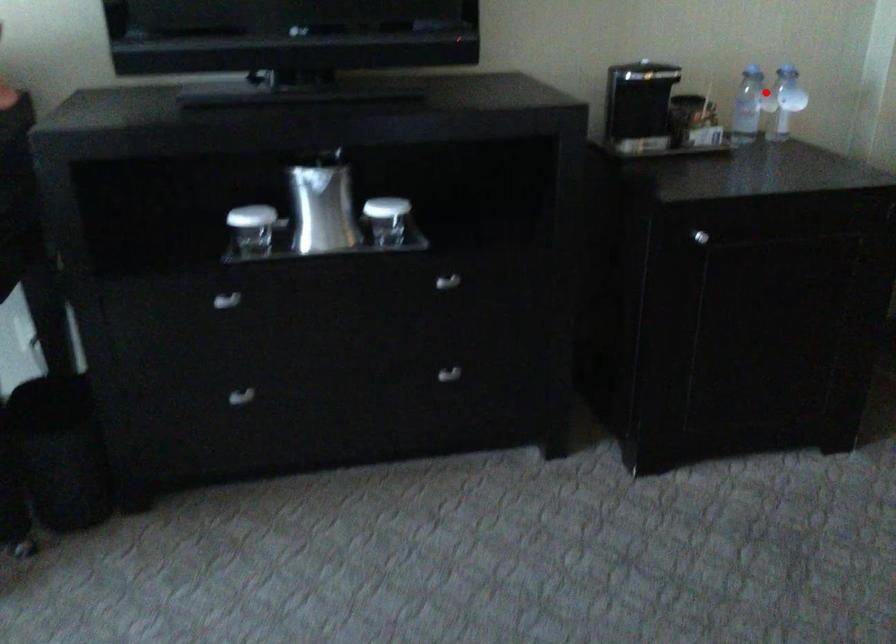
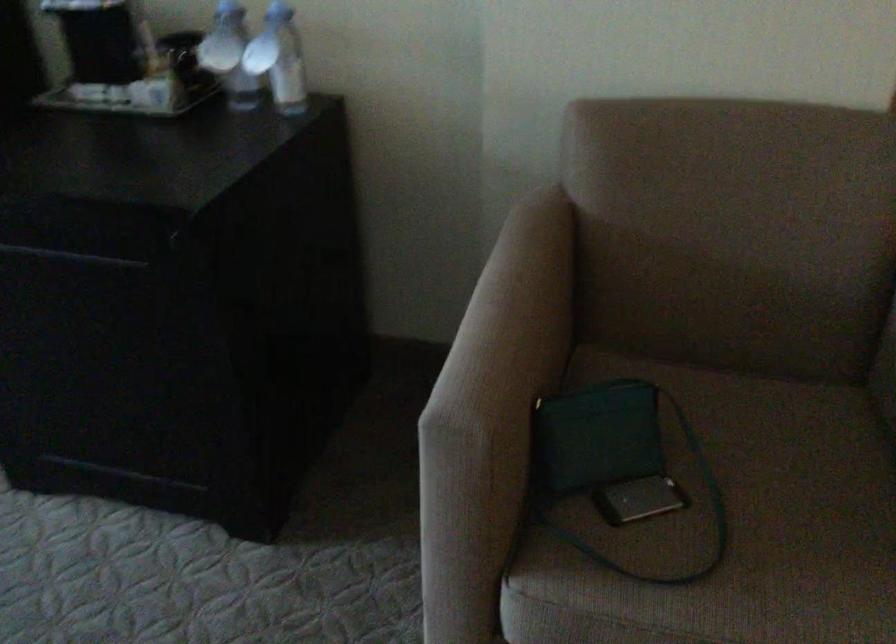
Find the pixel in the second image that matches the highlighted location in the first image.

(229, 55)